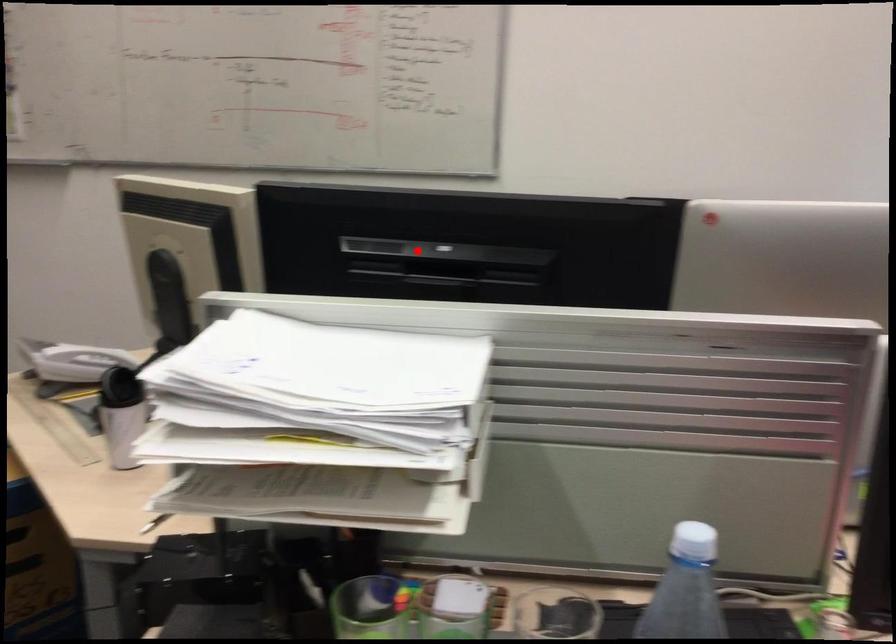
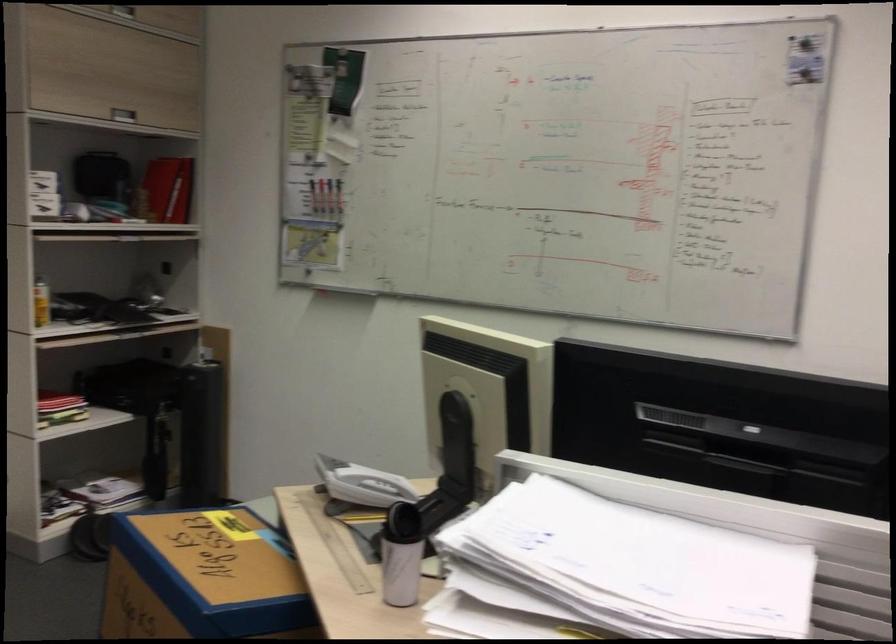
Locate, in the second image, the point that corresponds to the highlighted location in the first image.

(724, 426)